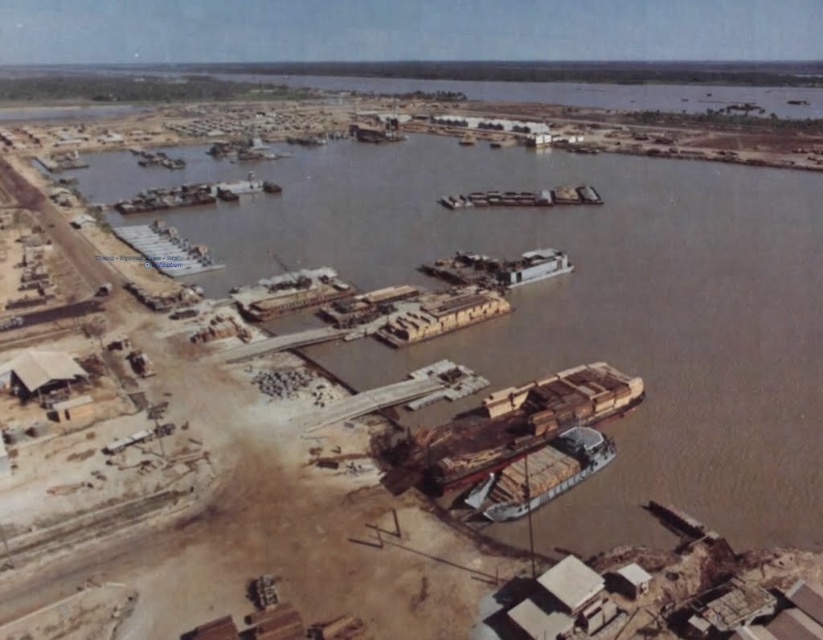
You are a delivery person standing on the brown wooden dock at center. You need to move a heavy crate to the wooden planks at center. Considering the height difference between the two, will you need a ladder or ramp to safely move the crate down?

The brown wooden dock at center has a greater height compared to wooden planks at center, so you will need a ladder or ramp to safely move the crate down from the brown wooden dock at center to the wooden planks at center.

You are a delivery person standing on the brown wooden dock at center and need to reach the wooden planks boat at lower center. Which direction should you move to get there?

The brown wooden dock at center is to the left of the wooden planks boat at lower center, so you should move to the right to reach it.